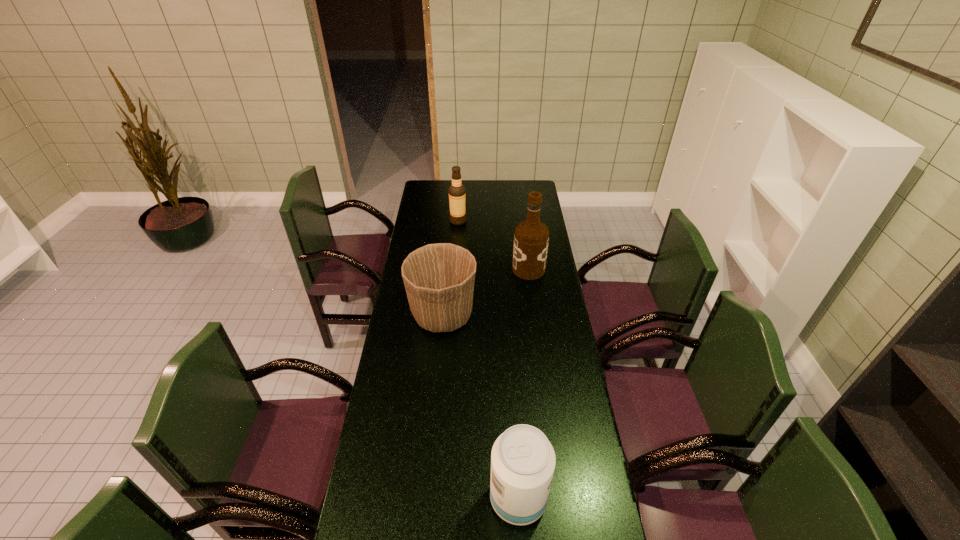
I want to click on the tallest alcohol, so click(x=531, y=237).

Locate an element on the screen. The height and width of the screenshot is (540, 960). the third nearest object is located at coordinates (531, 237).

Image resolution: width=960 pixels, height=540 pixels. I want to click on the leftmost alcohol, so click(x=456, y=191).

This screenshot has height=540, width=960. Identify the location of the farthest alcohol. (456, 191).

Where is `the nearest alcohol`? This screenshot has width=960, height=540. the nearest alcohol is located at coordinates (523, 460).

Find the location of a particular element. flowerpot is located at coordinates (439, 278).

In order to click on free space located on the label of the tallest object in this screenshot , I will do `click(467, 269)`.

This screenshot has width=960, height=540. Find the location of `vacant point located 0.120m on the label of the tallest object`. vacant point located 0.120m on the label of the tallest object is located at coordinates (488, 269).

Find the location of `vacant space located on the label of the tallest object`. vacant space located on the label of the tallest object is located at coordinates (446, 269).

Image resolution: width=960 pixels, height=540 pixels. In order to click on vacant area situated 0.230m on the label of the leftmost alcohol in this screenshot , I will do `click(508, 221)`.